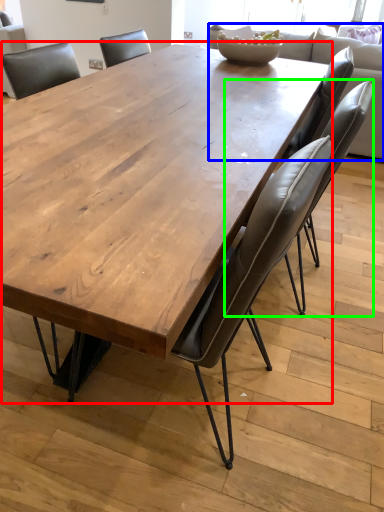
Question: Which object is the farthest from coffee table (highlighted by a red box)? Choose among these: couch (highlighted by a blue box) or chair (highlighted by a green box).

Choices:
 (A) couch
 (B) chair

Answer: (A)